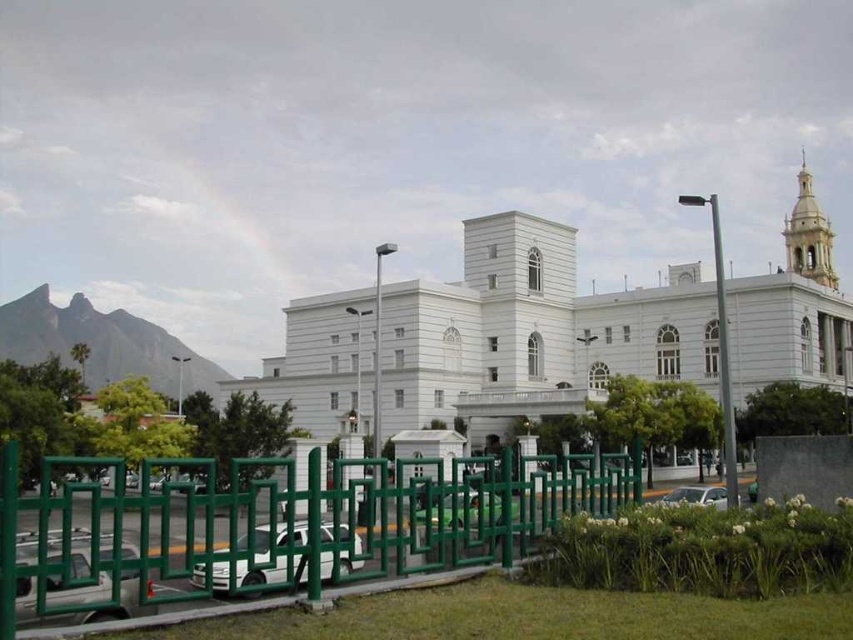
You are standing at the point with coordinates (532, 332) in the image. Based on the scene described, what object are you most likely looking at?

The point at (532, 332) corresponds to the white smooth building at center, so you are most likely looking at the white smooth building at center.

You are standing at the entrance of the white smooth building at center. If you walk straight ahead, will you face the green metal fence or the road beyond?

The white smooth building at center is located at point (532, 332), so walking straight ahead from the entrance would face the green metal fence since it is in the foreground.

You are a delivery person standing at the green metal fence at lower center, and you need to deliver a package to the entrance of the white smooth building at center. Considering the distance between them, can you estimate how many steps you would need to take to reach the building from the fence?

The distance between the white smooth building at center and the green metal fence at lower center is 28.62 meters. Assuming an average step length of about 0.76 meters, you would need approximately 37.66 steps. Since you can only take whole steps, you would need about 38 steps to reach the building from the fence.